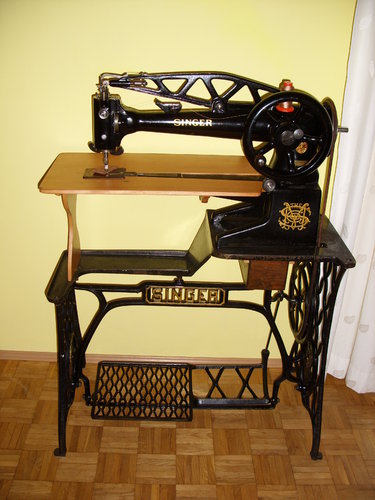
Identify the location of moulding. (171, 358).